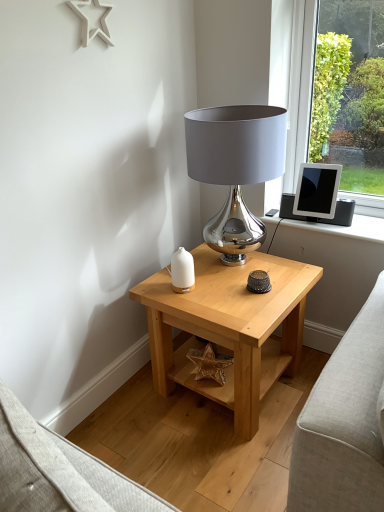
Find the location of `free space on the front side of white glossy vase at center`. free space on the front side of white glossy vase at center is located at coordinates (193, 306).